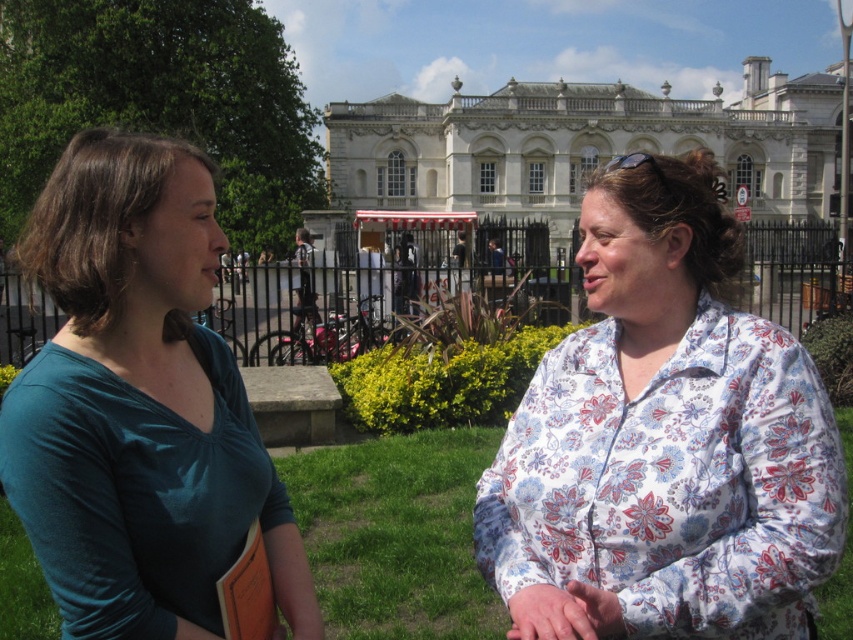
Question: Does floral cotton shirt at center appear under white glossy building at center?

Choices:
 (A) yes
 (B) no

Answer: (A)

Question: Does floral cotton shirt at center appear on the left side of white glossy building at center?

Choices:
 (A) no
 (B) yes

Answer: (B)

Question: Can you confirm if floral cotton shirt at center is wider than white glossy building at center?

Choices:
 (A) yes
 (B) no

Answer: (B)

Question: Which is farther from the white glossy building at center?

Choices:
 (A) floral cotton shirt at center
 (B) teal fabric shirt at left

Answer: (B)

Question: Estimate the real-world distances between objects in this image. Which object is closer to the white glossy building at center?

Choices:
 (A) teal fabric shirt at left
 (B) floral cotton shirt at center

Answer: (B)

Question: Which point is closer to the camera taking this photo?

Choices:
 (A) (51, 273)
 (B) (685, 134)

Answer: (A)